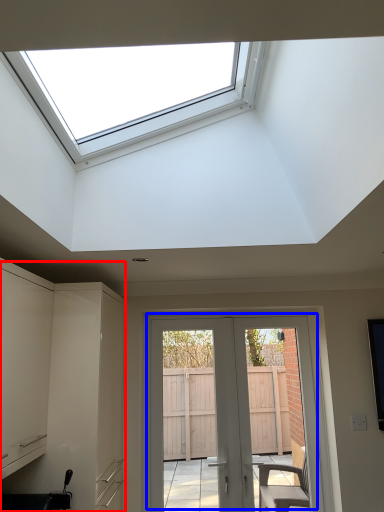
Question: Which of the following is the closest to the observer, cabinetry (highlighted by a red box) or door (highlighted by a blue box)?

Choices:
 (A) cabinetry
 (B) door

Answer: (A)